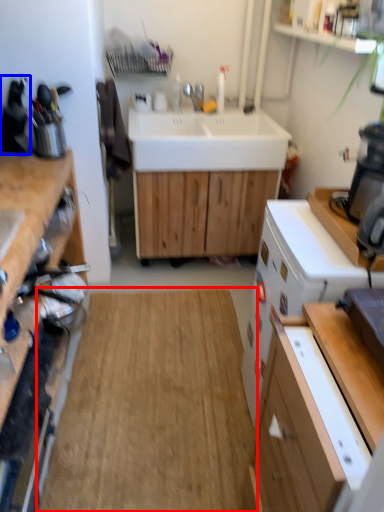
Question: Which object appears farthest to the camera in this image, hardwood (highlighted by a red box) or appliance (highlighted by a blue box)?

Choices:
 (A) hardwood
 (B) appliance

Answer: (B)